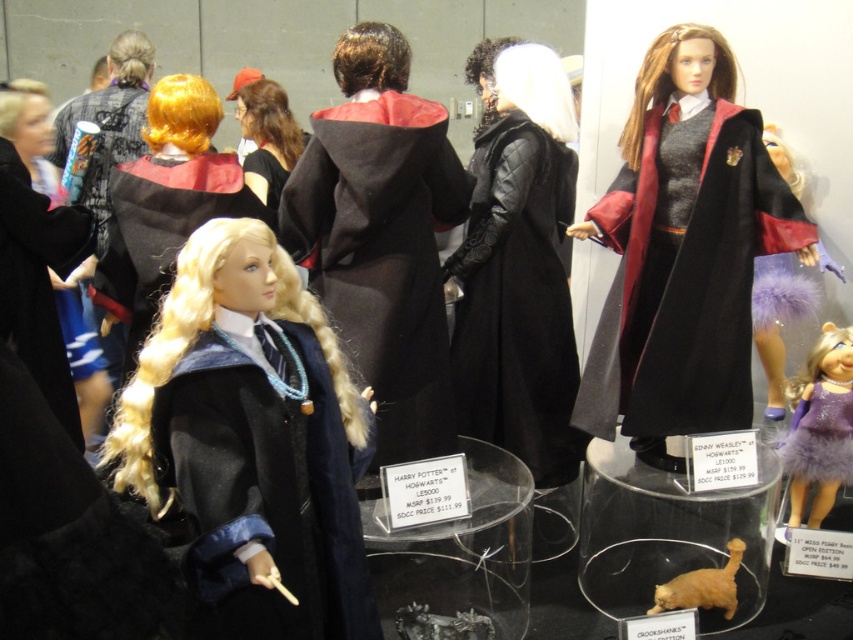
Question: Can you confirm if matte black robe at center is positioned to the right of shiny gold hair at center?

Choices:
 (A) no
 (B) yes

Answer: (B)

Question: Among these points, which one is farthest from the camera?

Choices:
 (A) pyautogui.click(x=149, y=310)
 (B) pyautogui.click(x=805, y=412)

Answer: (B)

Question: Does dark gray woolen robe at center appear over purple furry dress at lower right?

Choices:
 (A) no
 (B) yes

Answer: (B)

Question: Can you confirm if velvet maroon cape at right is smaller than dark gray woolen robe at center?

Choices:
 (A) yes
 (B) no

Answer: (B)

Question: Which point appears farthest from the camera in this image?

Choices:
 (A) [126, 467]
 (B) [834, 442]
 (C) [158, 260]
 (D) [48, 385]

Answer: (B)

Question: Which of the following is the farthest from the observer?

Choices:
 (A) golden fur cat at lower center
 (B) purple furry dress at lower right
 (C) matte black robe at center

Answer: (B)